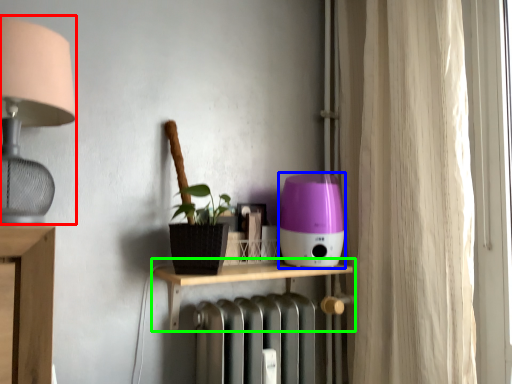
Question: Considering the real-world distances, which object is closest to lamp (highlighted by a red box)? appliance (highlighted by a blue box) or shelf (highlighted by a green box).

Choices:
 (A) appliance
 (B) shelf

Answer: (B)